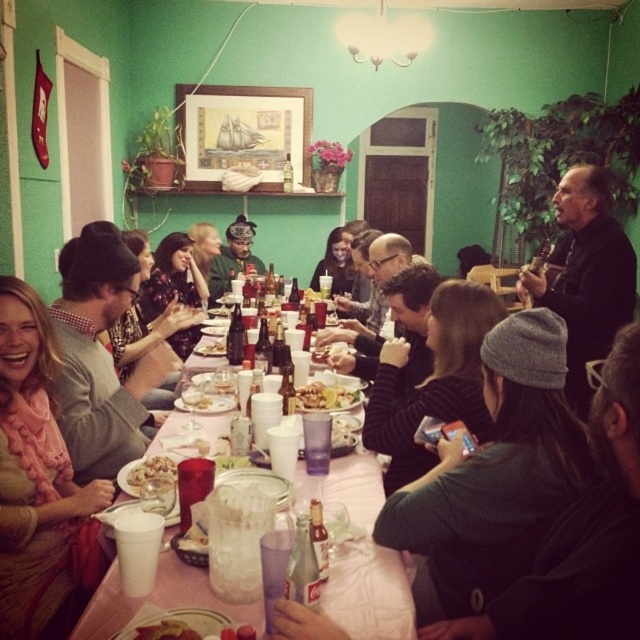
Can you confirm if pink ruffled scarf at upper left is smaller than matte gray sweater at center?

Indeed, pink ruffled scarf at upper left has a smaller size compared to matte gray sweater at center.

Can you confirm if pink ruffled scarf at upper left is wider than matte gray sweater at center?

Incorrect, pink ruffled scarf at upper left's width does not surpass matte gray sweater at center's.

Which is in front, point (97, 497) or point (88, 406)?

Point (97, 497) is more forward.

Identify the location of pink ruffled scarf at upper left. (38, 484).

Who is higher up, gray knit cap at center or pink paper tablecloth at center?

gray knit cap at center is above.

Is gray knit cap at center thinner than pink paper tablecloth at center?

Result: Yes, gray knit cap at center is thinner than pink paper tablecloth at center.

I want to click on gray knit cap at center, so click(493, 476).

Identify the location of gray knit cap at center. (493, 476).

Can you confirm if yellowish matte food at center is smaller than golden brown crumbly pastry at table center?

Incorrect, yellowish matte food at center is not smaller in size than golden brown crumbly pastry at table center.

Looking at this image, is yellowish matte food at center thinner than golden brown crumbly pastry at table center?

In fact, yellowish matte food at center might be wider than golden brown crumbly pastry at table center.

Between point (307, 403) and point (140, 483), which one is positioned in front?

Point (140, 483) is in front.

Identify the location of yellowish matte food at center. Image resolution: width=640 pixels, height=640 pixels. (324, 396).